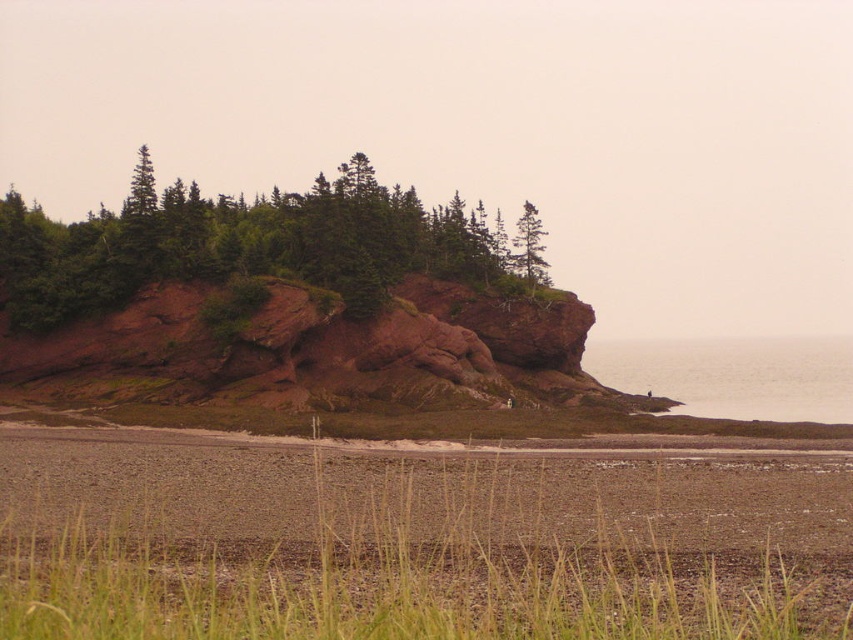
You are standing at the center of the image and want to place a small flag exactly at the green matte rock at center. What are the coordinates where you should place the flag?

The coordinates for the green matte rock at center are at point (242, 243), so you should place the flag there.

Looking at this image, you are standing at the cliff edge looking out to the sea. There are two points marked on the cliff face. The first point is at coordinates point [22,204] and the second point is at point [537,266]. Which point would you reach first if you were to descend the cliff face towards the sea?

You would reach point [22,204] first because it is closer to the viewer than point [537,266].